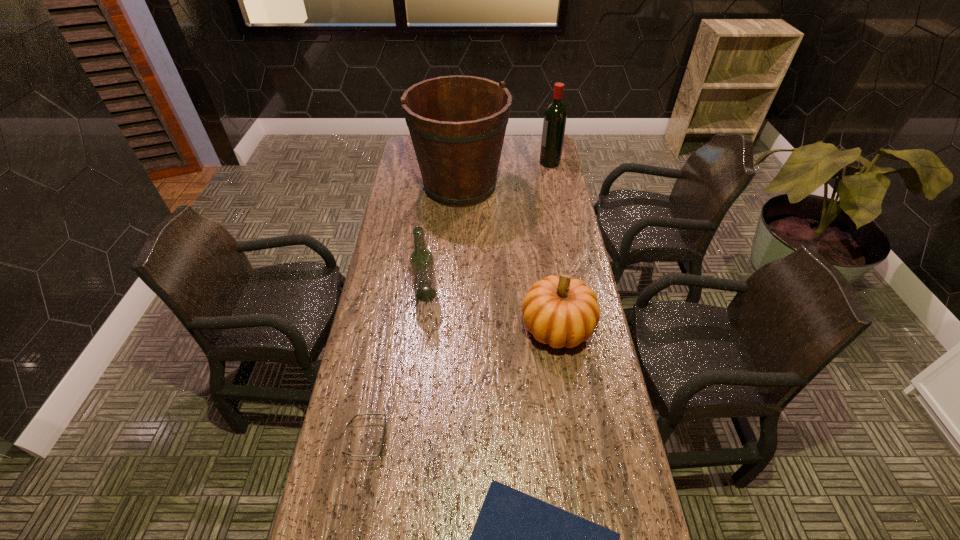
Where is `object that is at the far left corner`? The width and height of the screenshot is (960, 540). object that is at the far left corner is located at coordinates (457, 124).

The height and width of the screenshot is (540, 960). In order to click on object that is at the far right corner in this screenshot , I will do `click(555, 116)`.

You are a GUI agent. You are given a task and a screenshot of the screen. Output one action in this format:
    pyautogui.click(x=<x>, y=<y>)
    Task: Click on the vacant space at the left edge
    
    Given the screenshot: What is the action you would take?
    pyautogui.click(x=342, y=455)

Locate an element on the screen. This screenshot has height=540, width=960. blank area at the right edge is located at coordinates (536, 192).

Where is `vacant space in between the bucket and the pumpkin`? This screenshot has width=960, height=540. vacant space in between the bucket and the pumpkin is located at coordinates (509, 257).

Where is `vacant area between the bucket and the fourth tallest object`? The image size is (960, 540). vacant area between the bucket and the fourth tallest object is located at coordinates (509, 257).

Identify the location of vacant space that is in between the pumpkin and the fourth shortest object. The height and width of the screenshot is (540, 960). (492, 311).

Image resolution: width=960 pixels, height=540 pixels. In order to click on vacant region between the sunglasses and the fourth shortest object in this screenshot , I will do `click(396, 367)`.

Locate an element on the screen. This screenshot has height=540, width=960. object that ranks as the second closest to the fourth shortest object is located at coordinates (457, 124).

Select which object appears as the fifth closest to the shortest object. Please provide its 2D coordinates. Your answer should be formatted as a tuple, i.e. [(x, y)], where the tuple contains the x and y coordinates of a point satisfying the conditions above.

[(555, 116)]